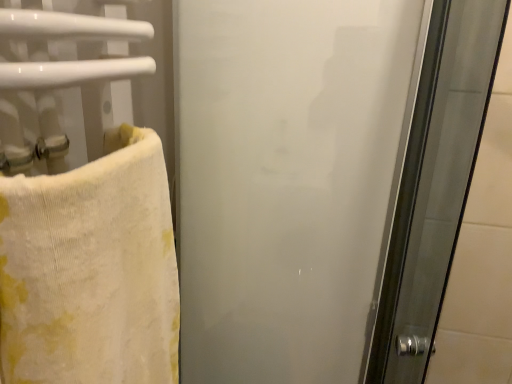
Question: From the image's perspective, does yellow cotton towel at left appear higher than frosted glass screen door at center?

Choices:
 (A) no
 (B) yes

Answer: (A)

Question: From a real-world perspective, is yellow cotton towel at left located beneath frosted glass screen door at center?

Choices:
 (A) yes
 (B) no

Answer: (B)

Question: Can you confirm if yellow cotton towel at left is bigger than frosted glass screen door at center?

Choices:
 (A) no
 (B) yes

Answer: (A)

Question: Is yellow cotton towel at left oriented away from frosted glass screen door at center?

Choices:
 (A) no
 (B) yes

Answer: (A)

Question: Is yellow cotton towel at left taller than frosted glass screen door at center?

Choices:
 (A) no
 (B) yes

Answer: (A)

Question: Could you tell me if yellow cotton towel at left is turned towards frosted glass screen door at center?

Choices:
 (A) no
 (B) yes

Answer: (A)

Question: Could you tell me if frosted glass screen door at center is turned towards yellow cotton towel at left?

Choices:
 (A) no
 (B) yes

Answer: (B)

Question: From a real-world perspective, is frosted glass screen door at center positioned over yellow cotton towel at left based on gravity?

Choices:
 (A) yes
 (B) no

Answer: (B)

Question: Is frosted glass screen door at center far away from yellow cotton towel at left?

Choices:
 (A) yes
 (B) no

Answer: (B)

Question: Is frosted glass screen door at center facing away from yellow cotton towel at left?

Choices:
 (A) yes
 (B) no

Answer: (B)

Question: Does frosted glass screen door at center have a greater height compared to yellow cotton towel at left?

Choices:
 (A) yes
 (B) no

Answer: (A)

Question: From a real-world perspective, is frosted glass screen door at center below yellow cotton towel at left?

Choices:
 (A) no
 (B) yes

Answer: (B)

Question: Considering the relative positions of frosted glass screen door at center and yellow cotton towel at left in the image provided, is frosted glass screen door at center to the left or to the right of yellow cotton towel at left?

Choices:
 (A) left
 (B) right

Answer: (B)